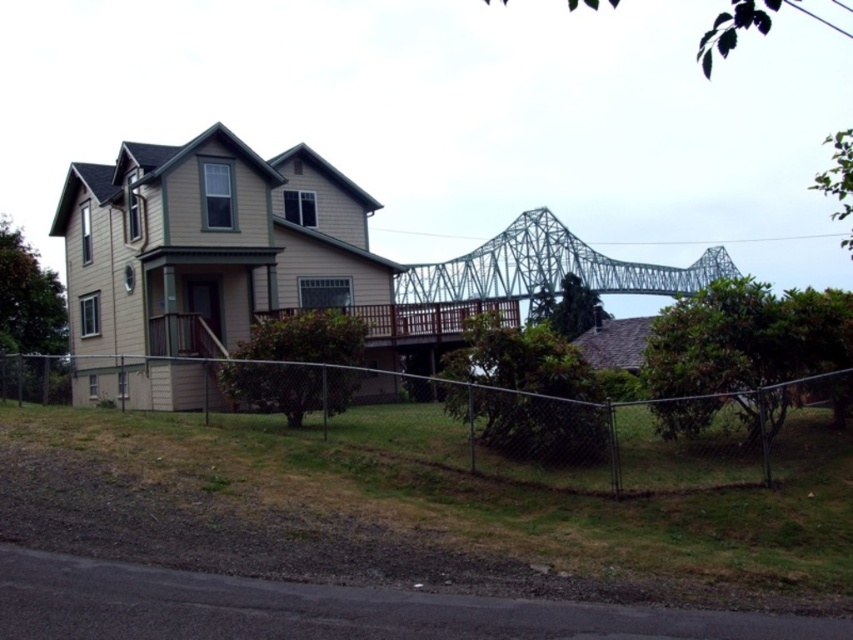
Question: Is chain-link fence at lower center positioned in front of green metallic bridge at upper center?

Choices:
 (A) yes
 (B) no

Answer: (A)

Question: Which object appears farthest from the camera in this image?

Choices:
 (A) green metallic bridge at upper center
 (B) chain-link fence at lower center

Answer: (A)

Question: Is chain-link fence at lower center below green metallic bridge at upper center?

Choices:
 (A) no
 (B) yes

Answer: (B)

Question: Which of the following is the closest to the observer?

Choices:
 (A) (415, 376)
 (B) (703, 268)

Answer: (A)

Question: Can you confirm if chain-link fence at lower center is bigger than green metallic bridge at upper center?

Choices:
 (A) no
 (B) yes

Answer: (A)